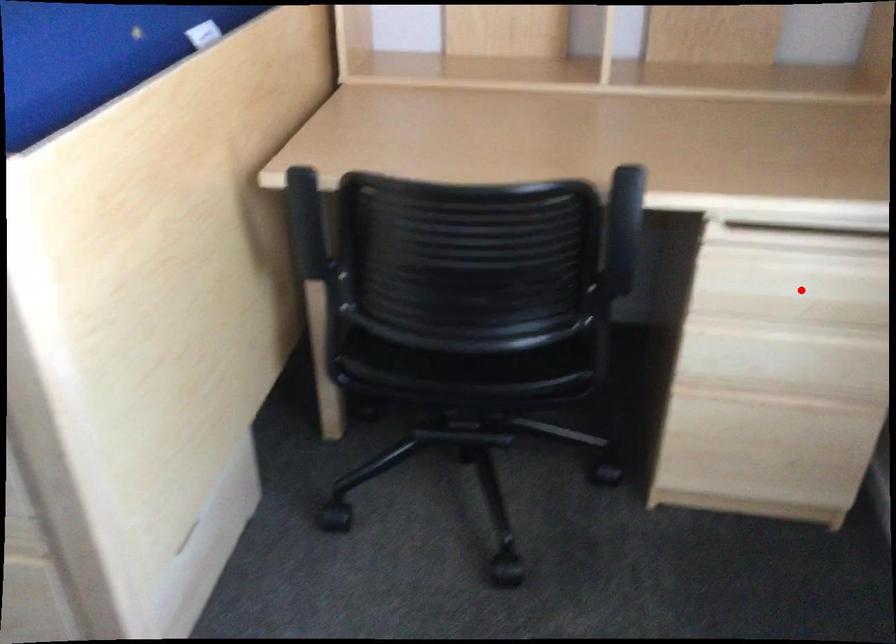
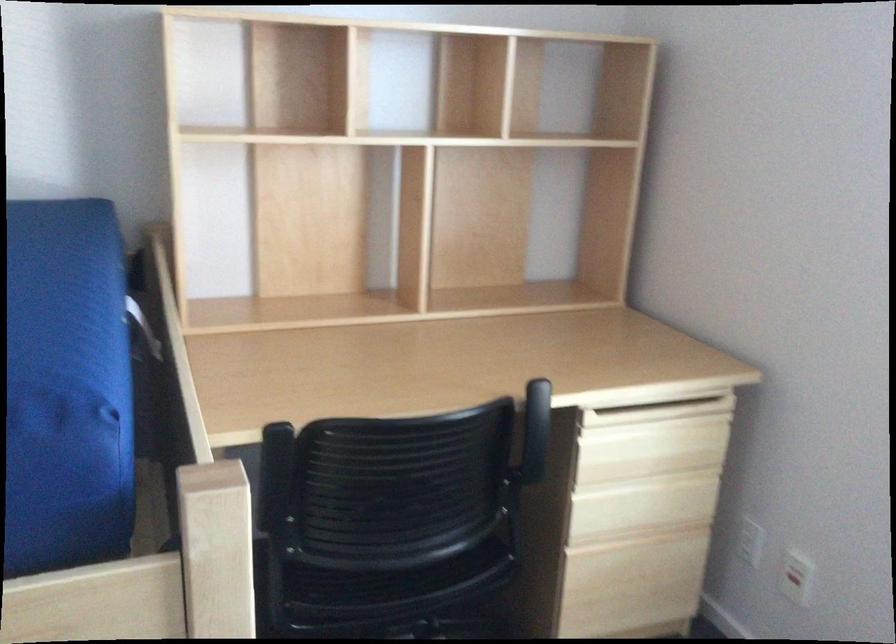
Question: I am providing you with two images of the same scene from different viewpoints. A red point is shown in image1. For the corresponding object point in image2, is it positioned nearer or farther from the camera?

Choices:
 (A) Nearer
 (B) Farther

Answer: (B)